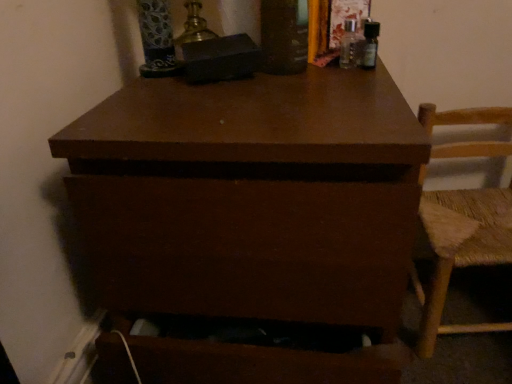
Question: Considering the relative sizes of brown matte chest of drawers at center and woven straw chair at right in the image provided, is brown matte chest of drawers at center smaller than woven straw chair at right?

Choices:
 (A) no
 (B) yes

Answer: (A)

Question: From a real-world perspective, is brown matte chest of drawers at center physically above woven straw chair at right?

Choices:
 (A) yes
 (B) no

Answer: (A)

Question: Is woven straw chair at right surrounded by brown matte chest of drawers at center?

Choices:
 (A) yes
 (B) no

Answer: (B)

Question: From the image's perspective, is brown matte chest of drawers at center beneath woven straw chair at right?

Choices:
 (A) yes
 (B) no

Answer: (B)

Question: Considering the relative positions of brown matte chest of drawers at center and woven straw chair at right in the image provided, is brown matte chest of drawers at center in front of woven straw chair at right?

Choices:
 (A) yes
 (B) no

Answer: (A)

Question: Does brown matte chest of drawers at center have a greater width compared to woven straw chair at right?

Choices:
 (A) no
 (B) yes

Answer: (B)

Question: Can you confirm if woven straw chair at right is shorter than brown matte chest of drawers at center?

Choices:
 (A) no
 (B) yes

Answer: (B)

Question: Is woven straw chair at right oriented away from brown matte chest of drawers at center?

Choices:
 (A) yes
 (B) no

Answer: (B)

Question: Does woven straw chair at right touch brown matte chest of drawers at center?

Choices:
 (A) yes
 (B) no

Answer: (B)

Question: Could brown matte chest of drawers at center be considered to be inside woven straw chair at right?

Choices:
 (A) yes
 (B) no

Answer: (B)

Question: Does woven straw chair at right come behind brown matte chest of drawers at center?

Choices:
 (A) yes
 (B) no

Answer: (A)

Question: From the image's perspective, is woven straw chair at right located above brown matte chest of drawers at center?

Choices:
 (A) yes
 (B) no

Answer: (B)

Question: In terms of height, does brown matte chest of drawers at center look taller or shorter compared to woven straw chair at right?

Choices:
 (A) short
 (B) tall

Answer: (B)